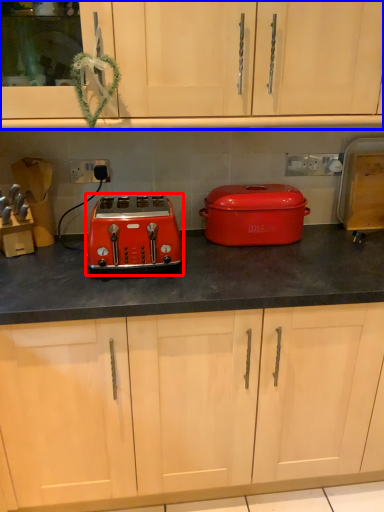
Question: Which of the following is the farthest to the observer, toaster (highlighted by a red box) or cabinetry (highlighted by a blue box)?

Choices:
 (A) toaster
 (B) cabinetry

Answer: (A)